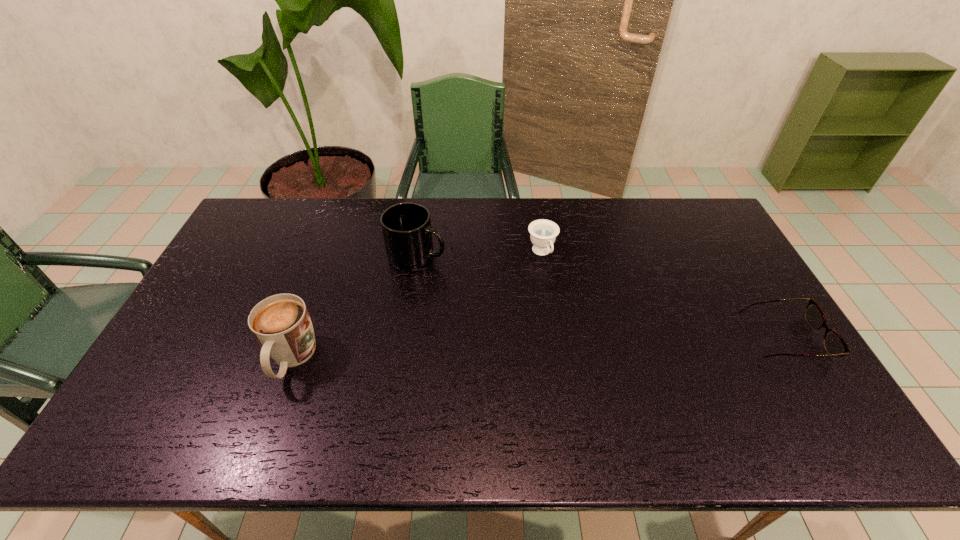
The width and height of the screenshot is (960, 540). In order to click on free space located 0.150m with the handle on the side of the farther mug in this screenshot , I will do `click(477, 286)`.

I want to click on free space located 0.100m on the side of the second shortest object with the handle, so click(560, 287).

Where is `vacant space located 0.170m on the side of the second shortest object with the handle`? Image resolution: width=960 pixels, height=540 pixels. vacant space located 0.170m on the side of the second shortest object with the handle is located at coordinates (569, 303).

Identify the location of vacant space situated on the side of the second shortest object with the handle. (560, 287).

This screenshot has width=960, height=540. In order to click on object present at the near edge in this screenshot , I will do `click(281, 323)`.

At what (x,y) coordinates should I click in order to perform the action: click on object present at the right edge. Please return your answer as a coordinate pair (x, y). The image size is (960, 540). Looking at the image, I should click on (835, 345).

Locate an element on the screen. The image size is (960, 540). vacant area at the far edge is located at coordinates (369, 205).

Identify the location of vacant space at the left edge. This screenshot has width=960, height=540. (202, 310).

The image size is (960, 540). I want to click on blank area at the right edge, so click(721, 282).

This screenshot has width=960, height=540. I want to click on vacant space at the far right corner of the desktop, so click(x=721, y=230).